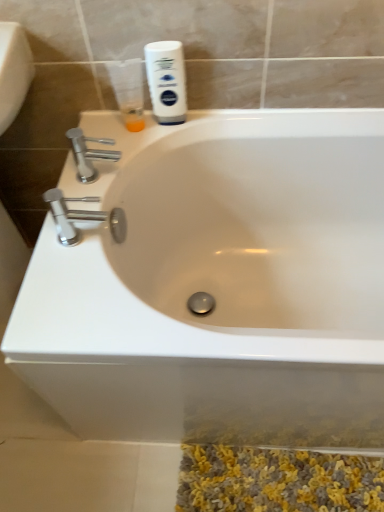
The image size is (384, 512). Find the location of `free point behind polished chrome faucet at upper left, which appears as the first tap when viewed from the top`. free point behind polished chrome faucet at upper left, which appears as the first tap when viewed from the top is located at coordinates (112, 143).